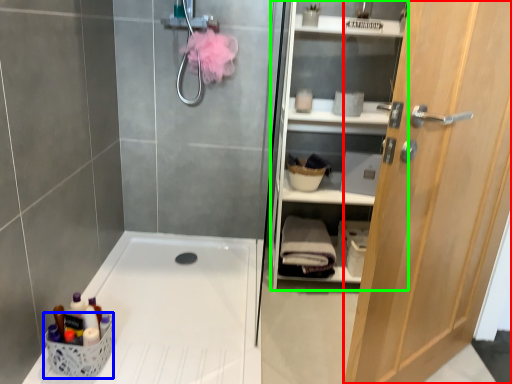
Question: Which is farther away from door (highlighted by a red box)? basket (highlighted by a blue box) or shelf (highlighted by a green box)?

Choices:
 (A) basket
 (B) shelf

Answer: (A)